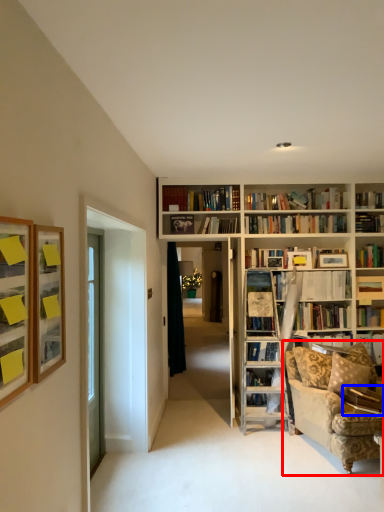
Question: Among these objects, which one is farthest to the camera, studio couch (highlighted by a red box) or book (highlighted by a blue box)?

Choices:
 (A) studio couch
 (B) book

Answer: (B)